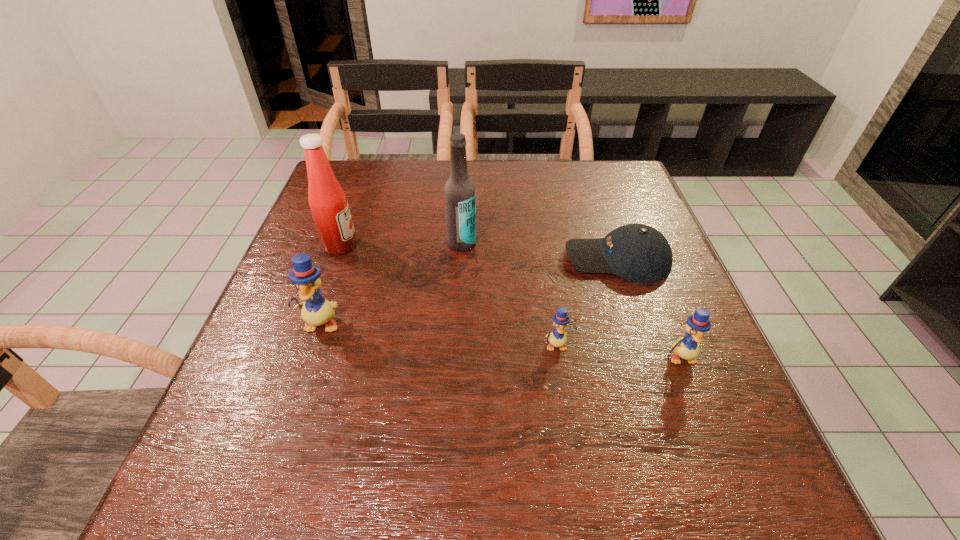
The height and width of the screenshot is (540, 960). I want to click on free space located 0.120m on the face of the second duckling from right to left, where the monocle is placed, so (565, 411).

Locate an element on the screen. free point located on the face of the rightmost duckling, where the monocle is placed is located at coordinates (694, 392).

Find the location of `free space located on the front-facing side of the condiment`. free space located on the front-facing side of the condiment is located at coordinates (521, 246).

Where is `free region located 0.140m on the front-facing side of the baseball cap`? free region located 0.140m on the front-facing side of the baseball cap is located at coordinates (505, 259).

Where is `free space located on the front-facing side of the baseball cap`? free space located on the front-facing side of the baseball cap is located at coordinates (467, 259).

The width and height of the screenshot is (960, 540). In order to click on free space located 0.350m on the front-facing side of the baseball cap in this screenshot , I will do `click(416, 259)`.

I want to click on blank space located 0.250m on the label of the fourth object from right to left, so click(x=457, y=335).

Find the location of a particular element. The width and height of the screenshot is (960, 540). duckling that is at the left edge is located at coordinates (316, 310).

Image resolution: width=960 pixels, height=540 pixels. In order to click on condiment that is at the left edge in this screenshot , I will do `click(328, 203)`.

At what (x,y) coordinates should I click in order to perform the action: click on duckling at the right edge. Please return your answer as a coordinate pair (x, y). Image resolution: width=960 pixels, height=540 pixels. Looking at the image, I should click on (687, 347).